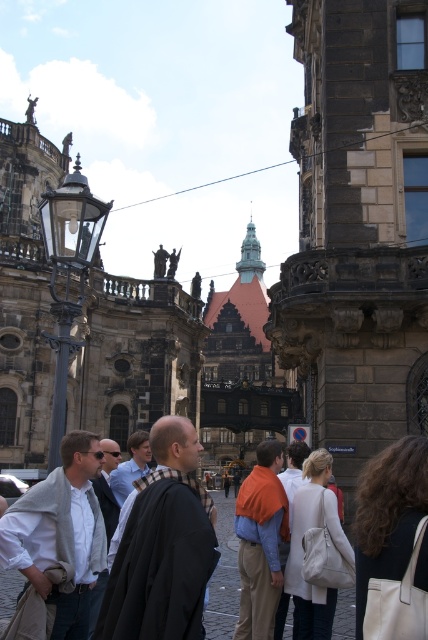
Question: Which object is positioned closest to the plaid wool scarf at center?

Choices:
 (A) white leather bag at lower right
 (B) black woolen robe at center

Answer: (A)

Question: Can you confirm if orange cotton sweater at center is positioned above plaid wool scarf at center?

Choices:
 (A) no
 (B) yes

Answer: (A)

Question: Based on their relative distances, which object is nearer to the black woolen robe at center?

Choices:
 (A) plaid wool scarf at center
 (B) light gray fabric jacket at center
 (C) dark brown leather bag at lower right

Answer: (C)

Question: Does orange cotton sweater at center have a greater width compared to light gray fabric jacket at center?

Choices:
 (A) yes
 (B) no

Answer: (A)

Question: Based on their relative distances, which object is nearer to the dark brown leather bag at lower right?

Choices:
 (A) plaid wool scarf at center
 (B) orange cotton sweater at center
 (C) white leather bag at lower right
 (D) black woolen robe at center

Answer: (C)

Question: Does light gray woolen robe at left appear on the right side of light gray fabric jacket at center?

Choices:
 (A) yes
 (B) no

Answer: (B)